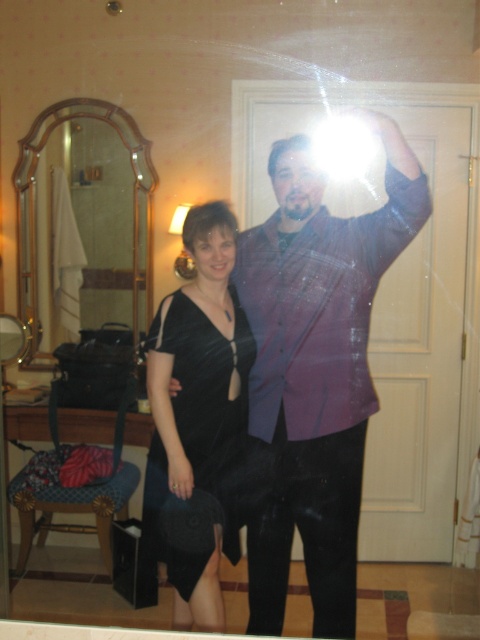
In the scene shown: You are a photographer setting up a photoshoot in this bathroom. You need to decide which dress, the black satin dress at left or the black velvet dress at center, will require more space to avoid looking cramped in the frame. Based on their sizes, which dress should you give more space to?

The black satin dress at left is wider than the black velvet dress at center, so you should give more space to the black satin dress at left to avoid it looking cramped in the frame.

You are a photographer trying to capture a closeup of the black satin dress at left. Based on its position in the image, where should you focus your camera? Please provide coordinates in the format of a point like this example format of point 0.5,0.5.

The black satin dress at left is located at point (316, 369), so you should focus your camera at point (316, 369) to capture a closeup.